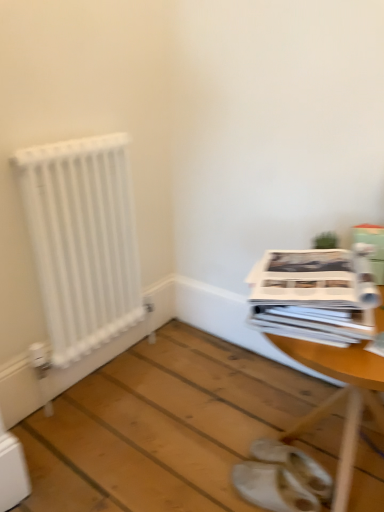
Question: Is the depth of white leather sandals at lower center less than that of white glossy magazine at right?

Choices:
 (A) yes
 (B) no

Answer: (B)

Question: Is white leather sandals at lower center to the left of white glossy magazine at right from the viewer's perspective?

Choices:
 (A) no
 (B) yes

Answer: (B)

Question: From the image's perspective, is white leather sandals at lower center over white glossy magazine at right?

Choices:
 (A) yes
 (B) no

Answer: (B)

Question: Considering the relative sizes of white leather sandals at lower center and white glossy magazine at right in the image provided, is white leather sandals at lower center smaller than white glossy magazine at right?

Choices:
 (A) yes
 (B) no

Answer: (A)

Question: From the image's perspective, is white leather sandals at lower center under white glossy magazine at right?

Choices:
 (A) yes
 (B) no

Answer: (A)

Question: Considering the positions of white matte radiator at left and white glossy magazine at right in the image, is white matte radiator at left taller or shorter than white glossy magazine at right?

Choices:
 (A) tall
 (B) short

Answer: (A)

Question: Is point (26, 190) closer or farther from the camera than point (266, 254)?

Choices:
 (A) closer
 (B) farther

Answer: (B)

Question: Based on their positions, is white matte radiator at left located to the left or right of white glossy magazine at right?

Choices:
 (A) left
 (B) right

Answer: (A)

Question: Is white matte radiator at left inside or outside of white glossy magazine at right?

Choices:
 (A) outside
 (B) inside

Answer: (A)

Question: Is point (377, 230) positioned closer to the camera than point (296, 434)?

Choices:
 (A) closer
 (B) farther

Answer: (A)

Question: Considering the positions of green cardboard box at upper right and wooden table at center in the image, is green cardboard box at upper right bigger or smaller than wooden table at center?

Choices:
 (A) small
 (B) big

Answer: (A)

Question: From a real-world perspective, relative to wooden table at center, is green cardboard box at upper right vertically above or below?

Choices:
 (A) below
 (B) above

Answer: (B)

Question: Considering their positions, is green cardboard box at upper right located in front of or behind wooden table at center?

Choices:
 (A) front
 (B) behind

Answer: (B)

Question: From a real-world perspective, is white leather sandals at lower center positioned above or below white glossy magazine at right?

Choices:
 (A) above
 (B) below

Answer: (B)

Question: From the image's perspective, is white leather sandals at lower center located above or below white glossy magazine at right?

Choices:
 (A) above
 (B) below

Answer: (B)